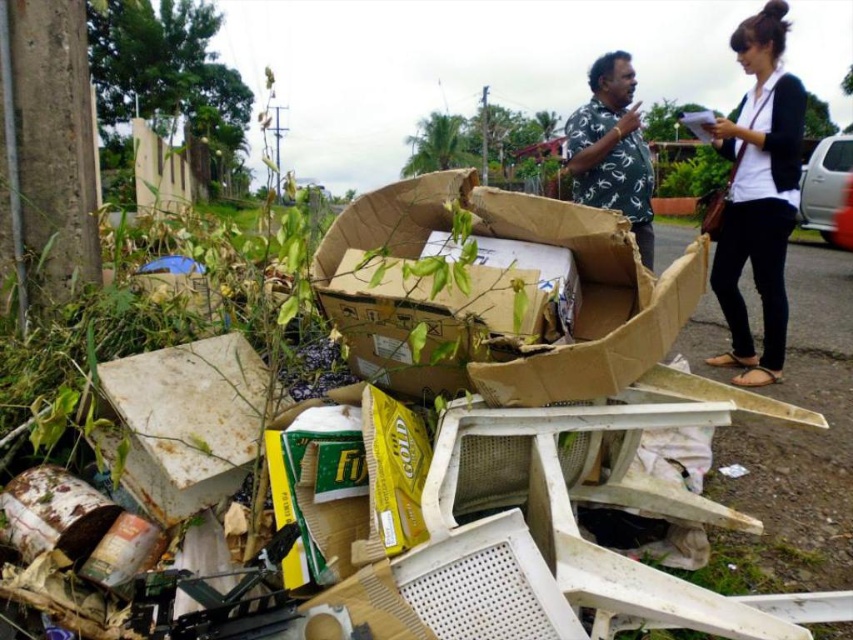
You are standing in front of the pile of discarded items and see two points marked in the image. Which point, point (407, 323) or point (746, 374), is closer to you?

Point (407, 323) is closer to the viewer than point (746, 374).

You are a waste management worker assessing the pile of discarded items. You notice the brown cardboard box at center and the white matte shirt at upper right. Which object is taller?

The white matte shirt at upper right is taller than the brown cardboard box at center.

You are a waste management worker assessing the pile of discarded items. You notice the brown cardboard box at center and the white printed shirt at upper center. Which object is shorter in height?

The brown cardboard box at center is not as tall as the white printed shirt at upper center, so the brown cardboard box at center is shorter in height.